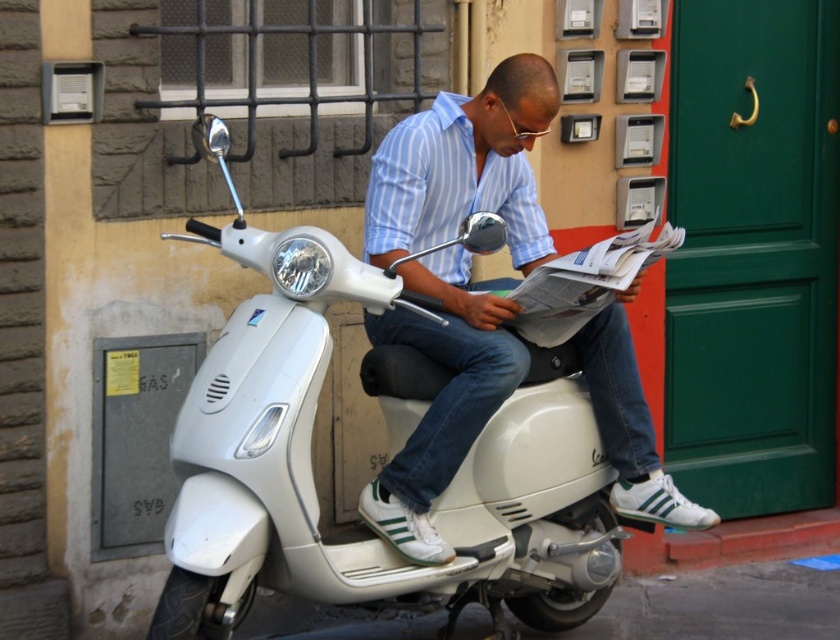
Question: Is white matte motorbike at center bigger than matte white scooter at center?

Choices:
 (A) no
 (B) yes

Answer: (B)

Question: Can you confirm if white matte motorbike at center is positioned below matte white scooter at center?

Choices:
 (A) no
 (B) yes

Answer: (B)

Question: Which of the following is the closest to the observer?

Choices:
 (A) (550, 604)
 (B) (412, 225)

Answer: (B)

Question: Can you confirm if white matte motorbike at center is positioned below matte white scooter at center?

Choices:
 (A) yes
 (B) no

Answer: (A)

Question: Which point is farther from the camera taking this photo?

Choices:
 (A) (290, 476)
 (B) (382, 330)

Answer: (B)

Question: Which object appears closest to the camera in this image?

Choices:
 (A) matte white scooter at center
 (B) white matte motorbike at center

Answer: (B)